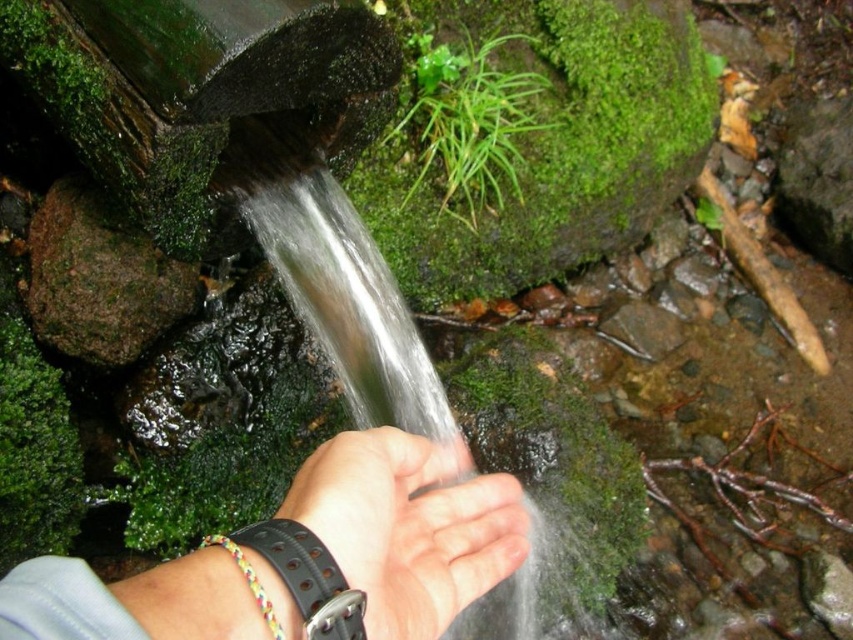
Which of these two, black leather wristband at center or skinny leather wristband at lower center, stands shorter?

Standing shorter between the two is skinny leather wristband at lower center.

Between black leather wristband at center and skinny leather wristband at lower center, which one has more height?

black leather wristband at center

The width and height of the screenshot is (853, 640). What do you see at coordinates (306, 557) in the screenshot? I see `black leather wristband at center` at bounding box center [306, 557].

The image size is (853, 640). Identify the location of black leather wristband at center. (306, 557).